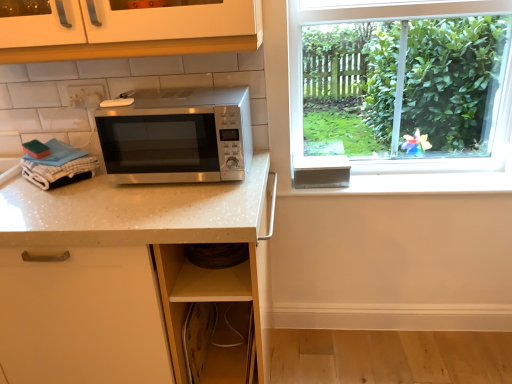
Question: Considering the relative sizes of white speckled quartz at center and white plastic electric outlet at upper left in the image provided, is white speckled quartz at center bigger than white plastic electric outlet at upper left?

Choices:
 (A) no
 (B) yes

Answer: (B)

Question: Does white speckled quartz at center have a greater width compared to white plastic electric outlet at upper left?

Choices:
 (A) no
 (B) yes

Answer: (B)

Question: Can you confirm if white speckled quartz at center is smaller than white plastic electric outlet at upper left?

Choices:
 (A) yes
 (B) no

Answer: (B)

Question: Is white speckled quartz at center closer to camera compared to white plastic electric outlet at upper left?

Choices:
 (A) yes
 (B) no

Answer: (A)

Question: Is white plastic electric outlet at upper left at the back of white speckled quartz at center?

Choices:
 (A) no
 (B) yes

Answer: (A)

Question: From a real-world perspective, is white speckled quartz at center above or below white plastic electric outlet at upper left?

Choices:
 (A) below
 (B) above

Answer: (A)

Question: From the image's perspective, is white speckled quartz at center above or below white plastic electric outlet at upper left?

Choices:
 (A) above
 (B) below

Answer: (B)

Question: Is white speckled quartz at center to the left or to the right of white plastic electric outlet at upper left in the image?

Choices:
 (A) right
 (B) left

Answer: (A)

Question: Based on their sizes in the image, would you say white speckled quartz at center is bigger or smaller than white plastic electric outlet at upper left?

Choices:
 (A) big
 (B) small

Answer: (A)

Question: Relative to satin silver microwave at center, is white plastic electric outlet at upper left in front or behind?

Choices:
 (A) front
 (B) behind

Answer: (B)

Question: Does point (78, 102) appear closer or farther from the camera than point (96, 122)?

Choices:
 (A) farther
 (B) closer

Answer: (A)

Question: From a real-world perspective, is white plastic electric outlet at upper left positioned above or below satin silver microwave at center?

Choices:
 (A) below
 (B) above

Answer: (B)

Question: Would you say white plastic electric outlet at upper left is inside or outside satin silver microwave at center?

Choices:
 (A) inside
 (B) outside

Answer: (B)

Question: Considering the positions of satin silver microwave at center and white plastic electric outlet at upper left in the image, is satin silver microwave at center bigger or smaller than white plastic electric outlet at upper left?

Choices:
 (A) big
 (B) small

Answer: (A)

Question: In the image, is satin silver microwave at center positioned in front of or behind white plastic electric outlet at upper left?

Choices:
 (A) behind
 (B) front

Answer: (B)